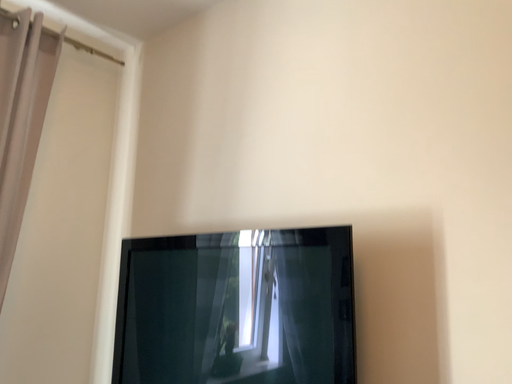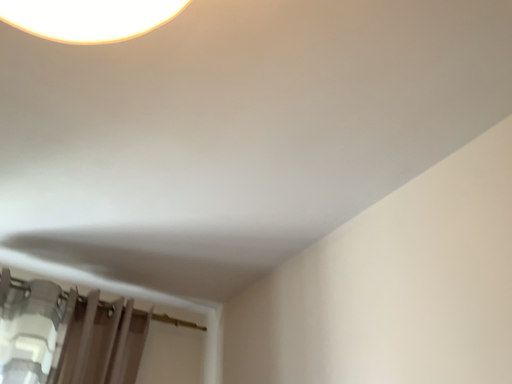
Question: Which way did the camera rotate in the video?

Choices:
 (A) rotated downward
 (B) rotated upward

Answer: (B)